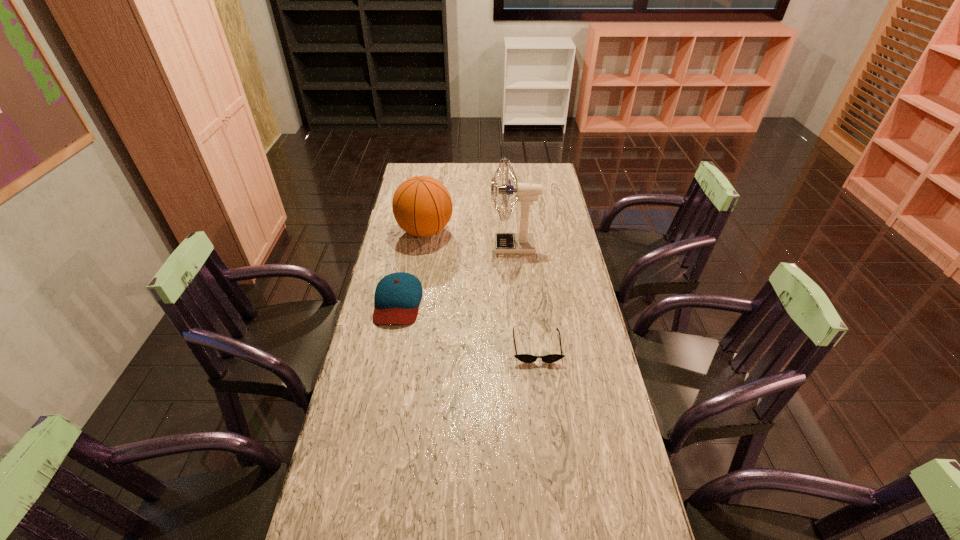
The width and height of the screenshot is (960, 540). Identify the location of blank area located with the bill of the third tallest object facing forward. point(384,373).

The width and height of the screenshot is (960, 540). Find the location of `vacant point located 0.250m on the front-facing side of the sunglasses`. vacant point located 0.250m on the front-facing side of the sunglasses is located at coordinates (548, 440).

Locate an element on the screen. The height and width of the screenshot is (540, 960). basketball situated at the left edge is located at coordinates (422, 206).

I want to click on baseball cap at the left edge, so pyautogui.click(x=397, y=297).

This screenshot has height=540, width=960. What are the coordinates of `fan that is positioned at the right edge` in the screenshot? It's located at [x=523, y=242].

Identify the location of sunglasses at the right edge. This screenshot has height=540, width=960. (526, 358).

Find the location of a particular element. blank area at the left edge is located at coordinates (410, 248).

You are a GUI agent. You are given a task and a screenshot of the screen. Output one action in this format:
    pyautogui.click(x=<x>, y=<y>)
    Task: Click on the free region at the right edge of the desktop
    Image resolution: width=960 pixels, height=540 pixels.
    Given the screenshot: What is the action you would take?
    pyautogui.click(x=610, y=436)

Image resolution: width=960 pixels, height=540 pixels. Find the location of `free space between the nearest object and the basketball`. free space between the nearest object and the basketball is located at coordinates (481, 289).

Identify the location of vacant area that lies between the sunglasses and the tallest object. (525, 296).